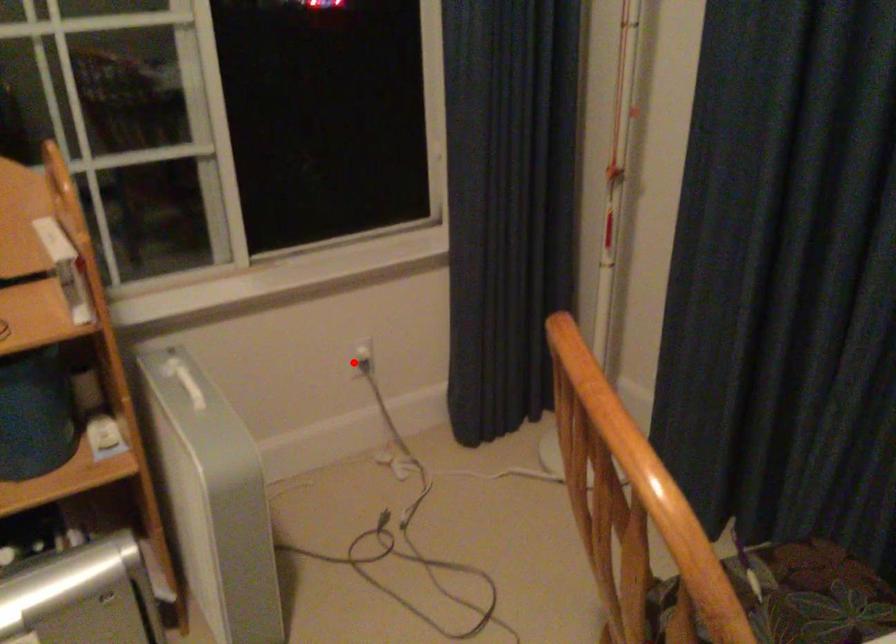
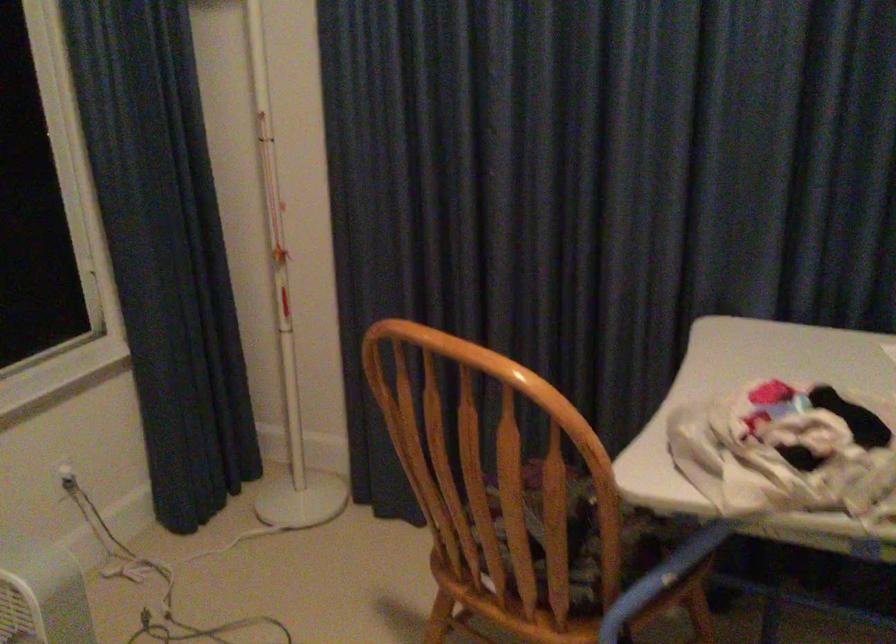
Find the pixel in the second image that matches the highlighted location in the first image.

(65, 478)